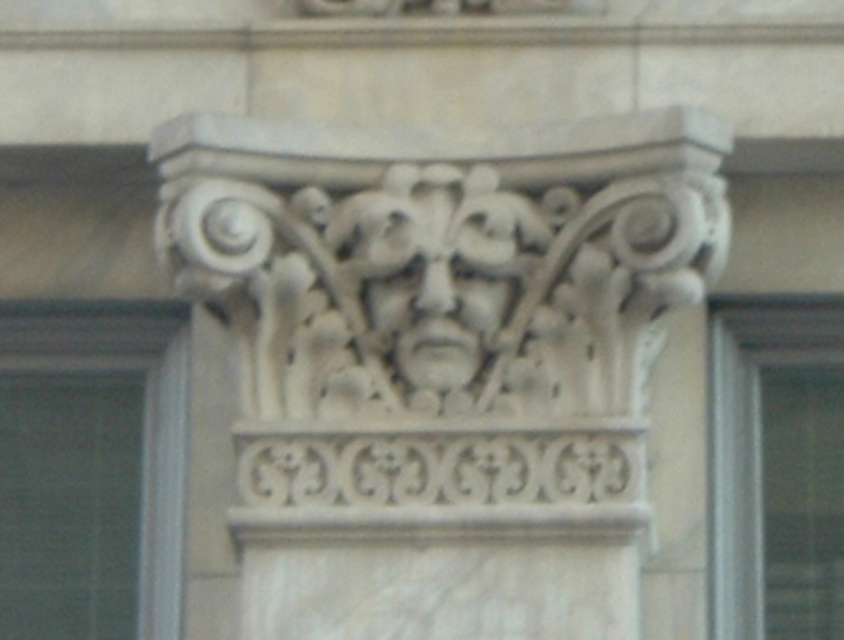
Question: Can you confirm if white stone carving at center is wider than white stone face at center?

Choices:
 (A) yes
 (B) no

Answer: (A)

Question: Does white stone carving at center appear under white stone face at center?

Choices:
 (A) no
 (B) yes

Answer: (B)

Question: Among these objects, which one is farthest from the camera?

Choices:
 (A) white stone face at center
 (B) white stone carving at center

Answer: (A)

Question: Which point is closer to the camera?

Choices:
 (A) (235, 262)
 (B) (402, 355)

Answer: (A)

Question: Is white stone carving at center thinner than white stone face at center?

Choices:
 (A) no
 (B) yes

Answer: (A)